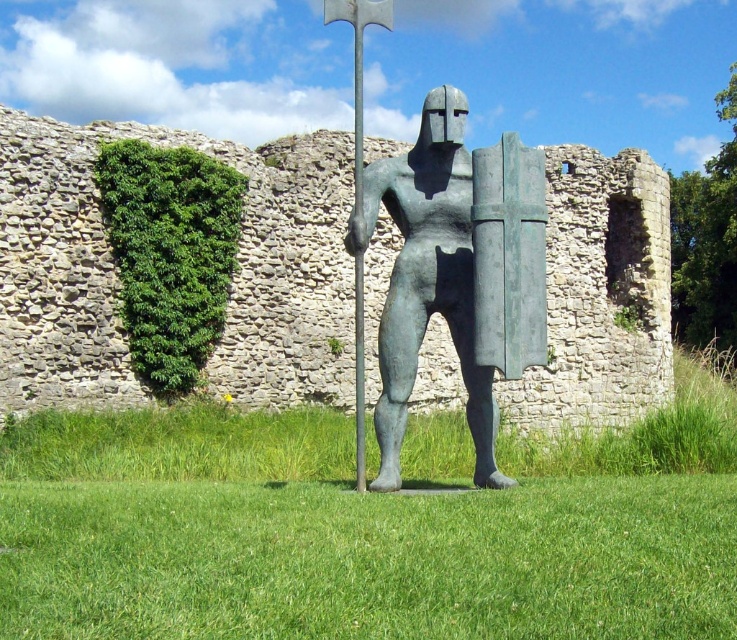
Is green grass at center to the right of bronze statue at center from the viewer's perspective?

Incorrect, green grass at center is not on the right side of bronze statue at center.

Is point (273, 481) closer to camera compared to point (495, 188)?

That is False.

The image size is (737, 640). I want to click on green grass at center, so click(366, 529).